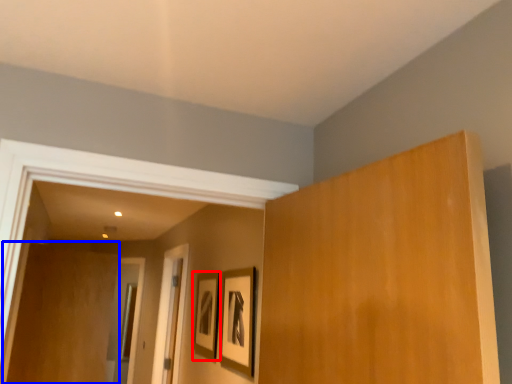
Question: Which object is closer to the camera taking this photo, picture frame (highlighted by a red box) or plywood (highlighted by a blue box)?

Choices:
 (A) picture frame
 (B) plywood

Answer: (A)